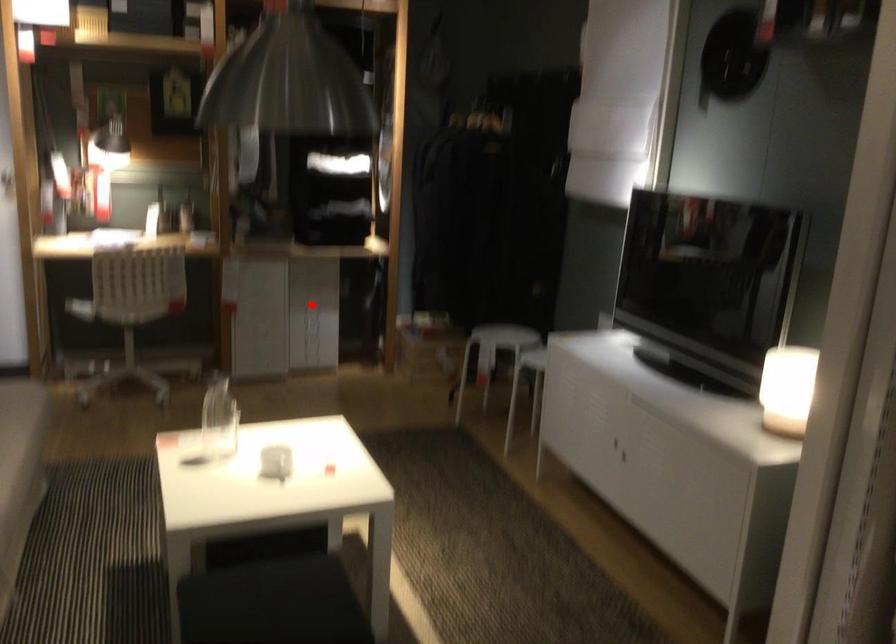
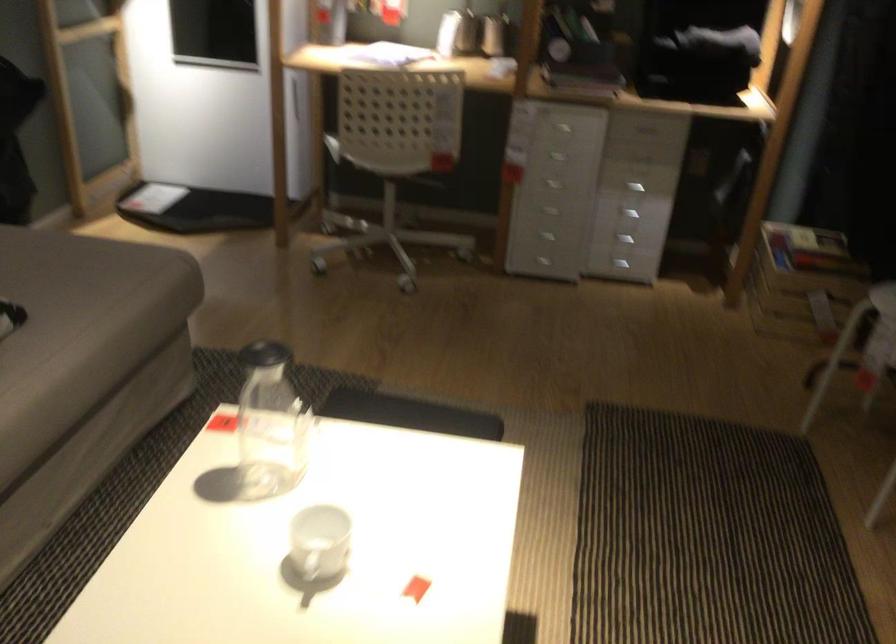
Question: I am providing you with two images of the same scene from different viewpoints. In image1, a red point is highlighted. Considering the same 3D point in image2, which of the following is correct?

Choices:
 (A) It is closer
 (B) It is farther

Answer: (A)